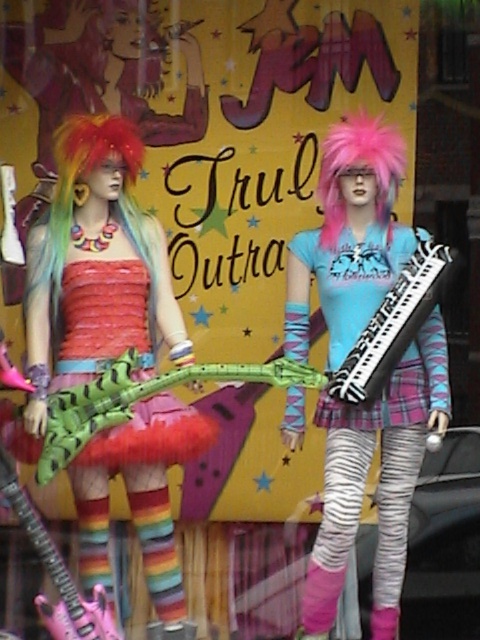
Question: Does green matte plastic toy at center have a smaller size compared to multicolored synthetic wig at left?

Choices:
 (A) yes
 (B) no

Answer: (B)

Question: Which point is closer to the camera?

Choices:
 (A) (400, 176)
 (B) (132, 204)

Answer: (A)

Question: Which point is farther to the camera?

Choices:
 (A) multicolored synthetic wig at left
 (B) black and white keyboard at center
 (C) zebra-patterned keyboard at center

Answer: (A)

Question: Does multicolored synthetic wig at left appear on the left side of black and white keyboard at center?

Choices:
 (A) no
 (B) yes

Answer: (B)

Question: Is green matte guitar at center positioned at the back of multicolored synthetic wig at left?

Choices:
 (A) no
 (B) yes

Answer: (A)

Question: Considering the real-world distances, which object is farthest from the black and white keyboard at center?

Choices:
 (A) pink fluffy wig at center
 (B) green matte plastic toy at center

Answer: (B)